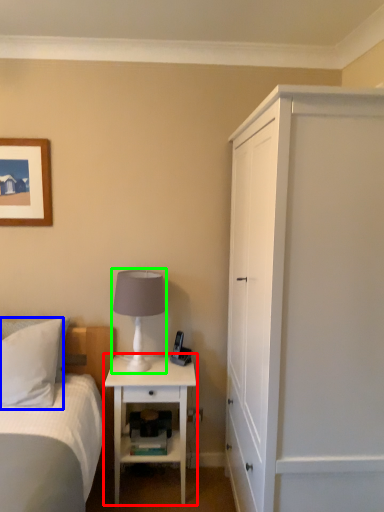
Question: Based on their relative distances, which object is nearer to nightstand (highlighted by a red box)? Choose from pillow (highlighted by a blue box) and table lamp (highlighted by a green box).

Choices:
 (A) pillow
 (B) table lamp

Answer: (B)